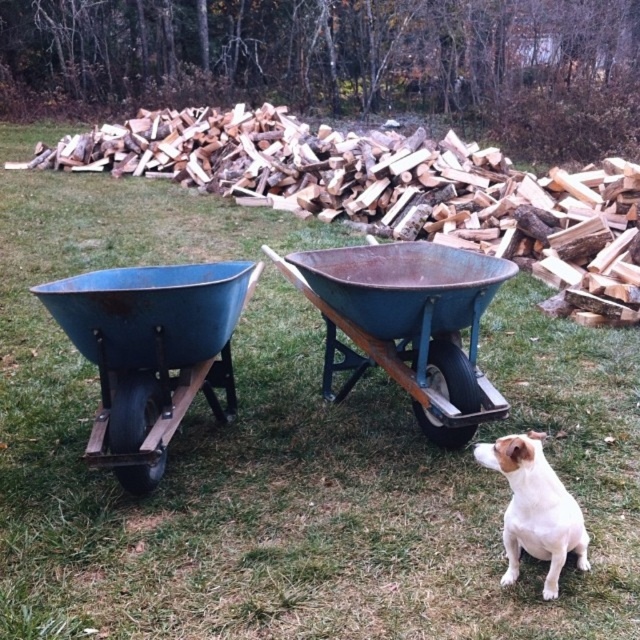
Which of these two, rustic metal wheelbarrow at center or white fur dog at lower right, stands taller?

With more height is rustic metal wheelbarrow at center.

Between point (586, 176) and point (550, 547), which one is positioned in front?

Positioned in front is point (550, 547).

The image size is (640, 640). What are the coordinates of `rustic metal wheelbarrow at center` in the screenshot? It's located at (392, 192).

The width and height of the screenshot is (640, 640). I want to click on rustic metal wheelbarrow at center, so click(392, 192).

Can you confirm if rustic metal wheelbarrow at center is positioned below rusty metal wheelbarrow at center?

No, rustic metal wheelbarrow at center is not below rusty metal wheelbarrow at center.

What do you see at coordinates (392, 192) in the screenshot? I see `rustic metal wheelbarrow at center` at bounding box center [392, 192].

Image resolution: width=640 pixels, height=640 pixels. Identify the location of rustic metal wheelbarrow at center. (392, 192).

Who is more distant from viewer, (109, 275) or (570, 531)?

Positioned behind is point (109, 275).

Is the position of blue metal wheelbarrow at left more distant than that of white fur dog at lower right?

That is True.

Locate an element on the screen. blue metal wheelbarrow at left is located at coordinates (150, 353).

Where is `blue metal wheelbarrow at left`? Image resolution: width=640 pixels, height=640 pixels. blue metal wheelbarrow at left is located at coordinates (150, 353).